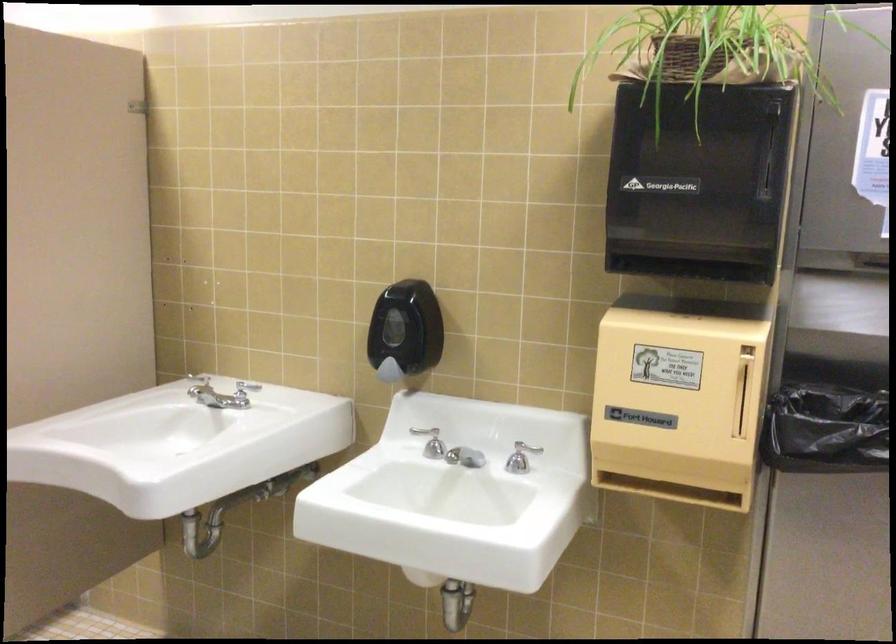
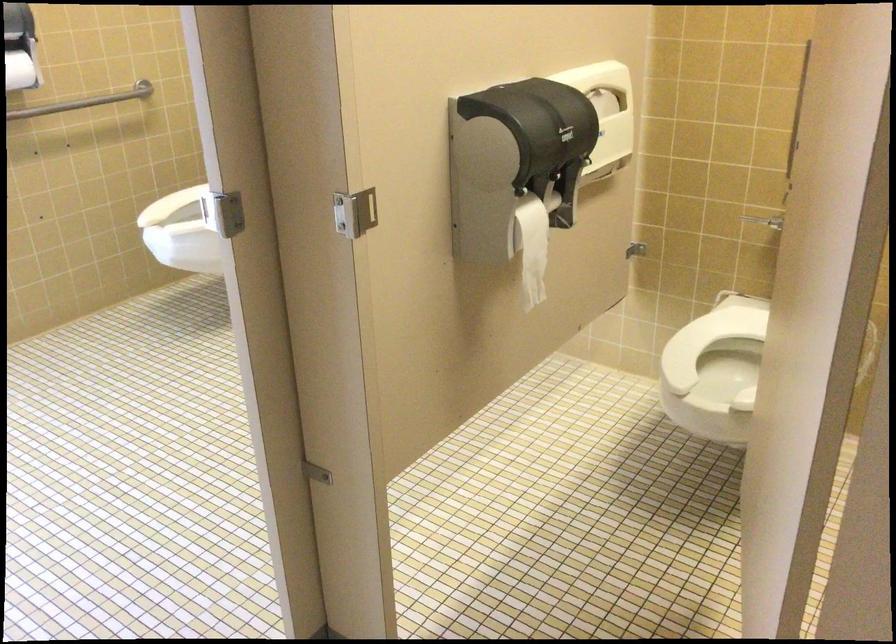
Question: The images are taken continuously from a first-person perspective. In which direction are you moving?

Choices:
 (A) Left
 (B) Right
 (C) Forward
 (D) Backward

Answer: (A)